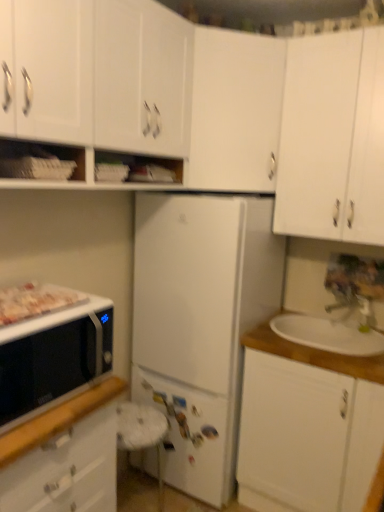
What are the coordinates of `free space above black matte microwave at left (from a real-world perspective)` in the screenshot? It's located at (42, 311).